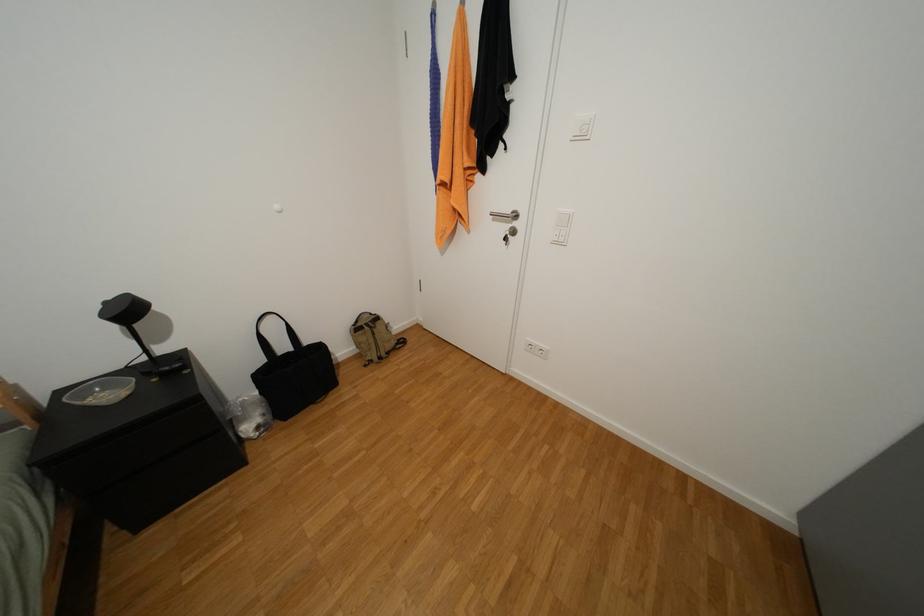
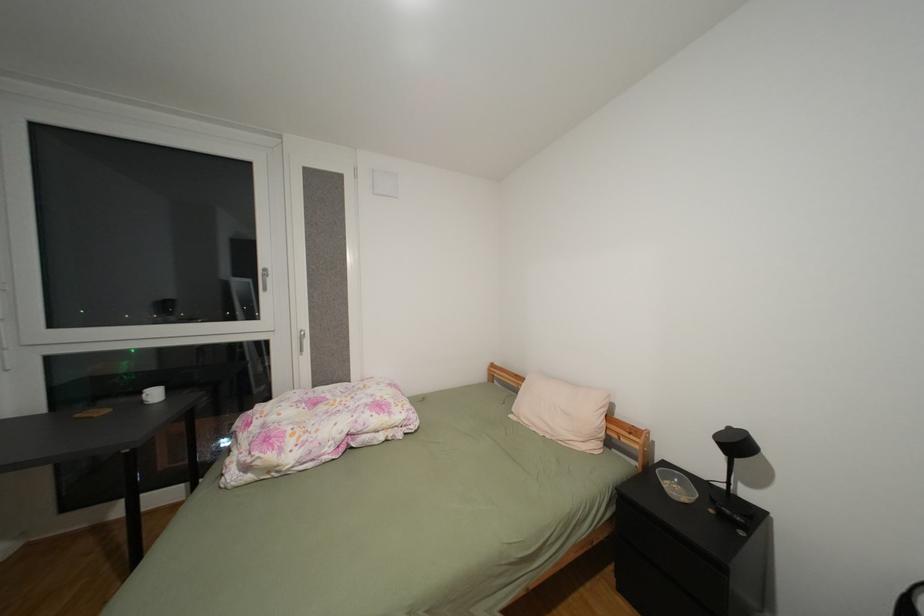
Question: Based on the continuous images, in which direction is the camera rotating? Reply with the corresponding letter.

Choices:
 (A) Left
 (B) Right
 (C) Up
 (D) Down

Answer: (A)